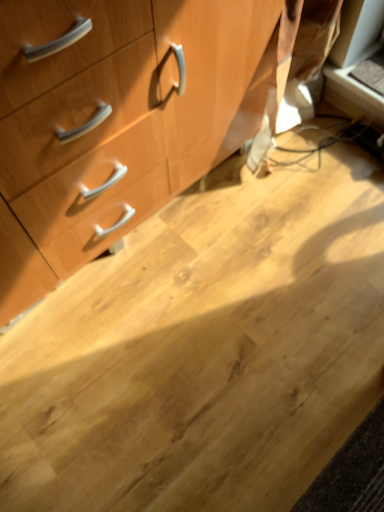
This screenshot has width=384, height=512. What do you see at coordinates (110, 122) in the screenshot? I see `matte wood chest of drawers at center` at bounding box center [110, 122].

The width and height of the screenshot is (384, 512). Find the location of `matte wood chest of drawers at center`. matte wood chest of drawers at center is located at coordinates (110, 122).

Image resolution: width=384 pixels, height=512 pixels. In order to click on matte wood chest of drawers at center in this screenshot , I will do `click(110, 122)`.